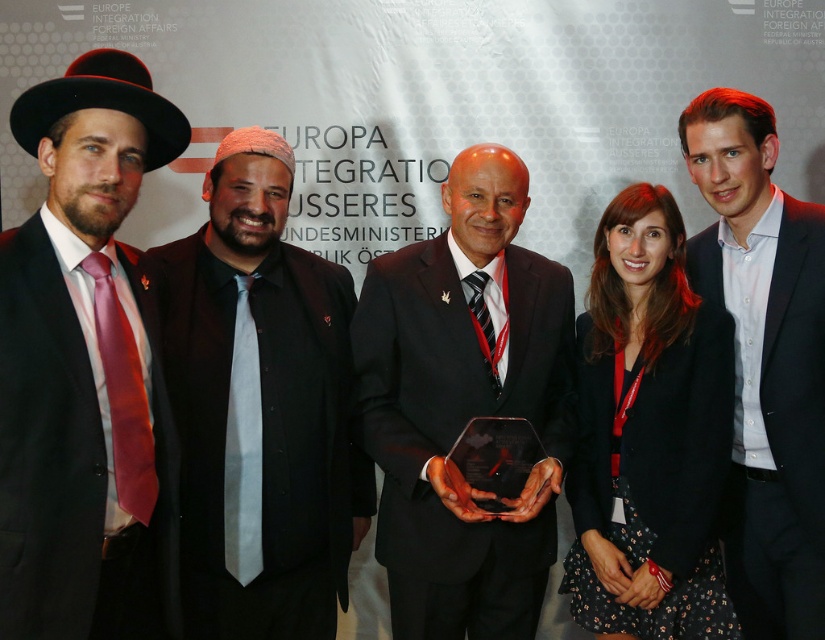
Who is higher up, black glossy award at center or black textured blazer at center?

black glossy award at center is above.

Can you confirm if black glossy award at center is taller than black textured blazer at center?

Yes, black glossy award at center is taller than black textured blazer at center.

Locate an element on the screen. Image resolution: width=825 pixels, height=640 pixels. black glossy award at center is located at coordinates (464, 404).

In order to click on black glossy award at center in this screenshot , I will do `click(464, 404)`.

Based on the photo, is matte black suit at left to the right of black textured blazer at center from the viewer's perspective?

No, matte black suit at left is not to the right of black textured blazer at center.

Who is positioned more to the left, matte black suit at left or black textured blazer at center?

From the viewer's perspective, matte black suit at left appears more on the left side.

The width and height of the screenshot is (825, 640). I want to click on matte black suit at left, so click(86, 371).

Find the location of `matte black suit at left`. matte black suit at left is located at coordinates (86, 371).

Which is behind, point (398, 339) or point (805, 268)?

The point (398, 339) is more distant.

Is point (404, 374) closer to viewer compared to point (752, 237)?

Yes, point (404, 374) is in front of point (752, 237).

Locate an element on the screen. The height and width of the screenshot is (640, 825). black glossy award at center is located at coordinates (464, 404).